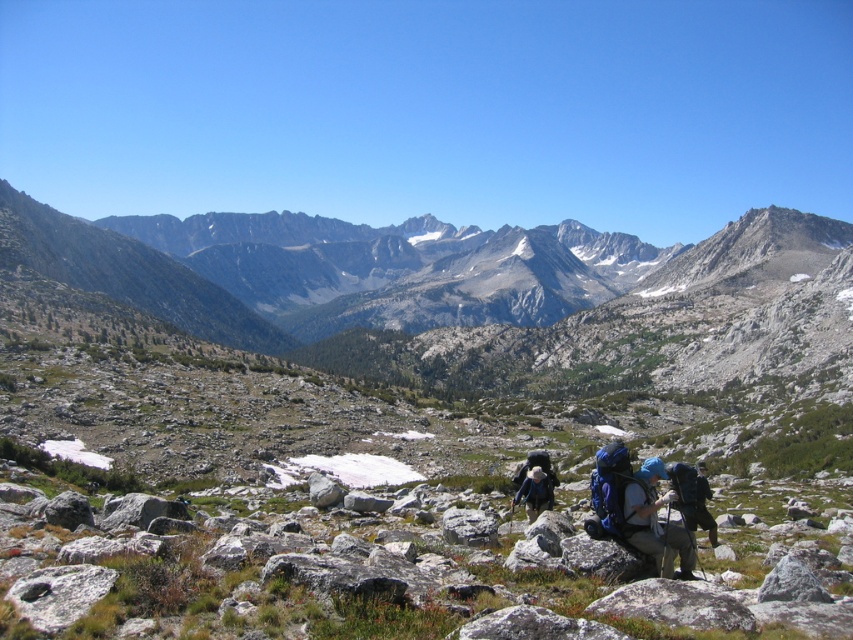
Question: Which point is closer to the camera?

Choices:
 (A) (97, 282)
 (B) (664, 561)
 (C) (378, 429)

Answer: (B)

Question: Does gray rocky mountain range at upper center lie in front of blue fabric backpack at center-right?

Choices:
 (A) no
 (B) yes

Answer: (A)

Question: Which object appears closest to the camera in this image?

Choices:
 (A) gray rough rock at lower left
 (B) blue fabric backpack at center
 (C) gray rock at center
 (D) rocky terrain at center

Answer: (A)

Question: Is blue fabric backpack at center-right to the left of gray rock at center from the viewer's perspective?

Choices:
 (A) yes
 (B) no

Answer: (B)

Question: Does gray rough rock at lower left appear over gray rock at center?

Choices:
 (A) yes
 (B) no

Answer: (A)

Question: Which object appears farthest from the camera in this image?

Choices:
 (A) blue fabric backpack at center
 (B) gray rough rock at lower left
 (C) gray rocky mountain range at upper center

Answer: (C)